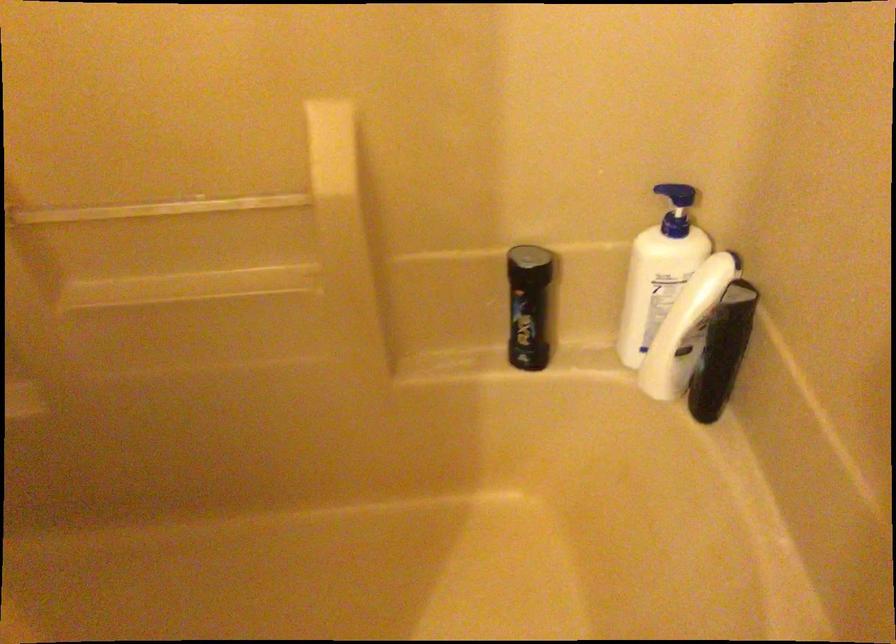
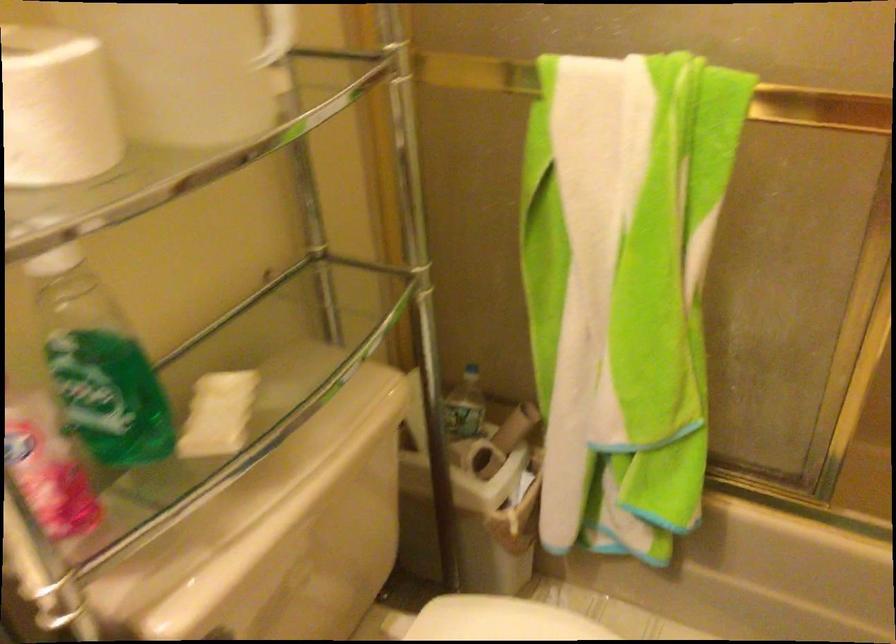
Question: The camera is either moving clockwise (left) or counter-clockwise (right) around the object. The first image is from the beginning of the video and the second image is from the end. Is the camera moving left or right when shooting the video?

Choices:
 (A) Left
 (B) Right

Answer: (B)